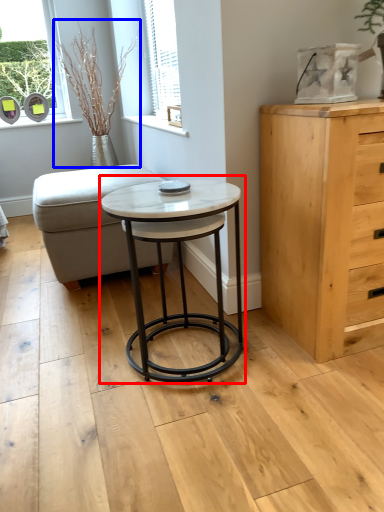
Question: Which of the following is the farthest to the observer, coffee table (highlighted by a red box) or plant (highlighted by a blue box)?

Choices:
 (A) coffee table
 (B) plant

Answer: (B)